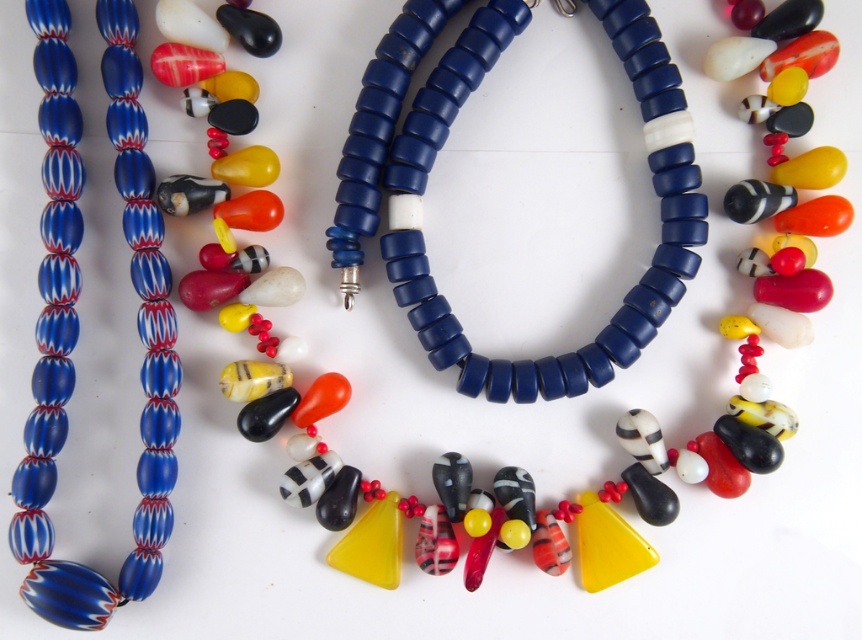
Question: Which point is closer to the camera?

Choices:
 (A) blue marbled beads at left
 (B) blue matte beads at center

Answer: (A)

Question: Does blue matte beads at center have a greater width compared to blue marbled beads at left?

Choices:
 (A) no
 (B) yes

Answer: (B)

Question: Does blue matte beads at center appear on the left side of blue marbled beads at left?

Choices:
 (A) no
 (B) yes

Answer: (A)

Question: Can you confirm if blue matte beads at center is positioned to the left of blue marbled beads at left?

Choices:
 (A) no
 (B) yes

Answer: (A)